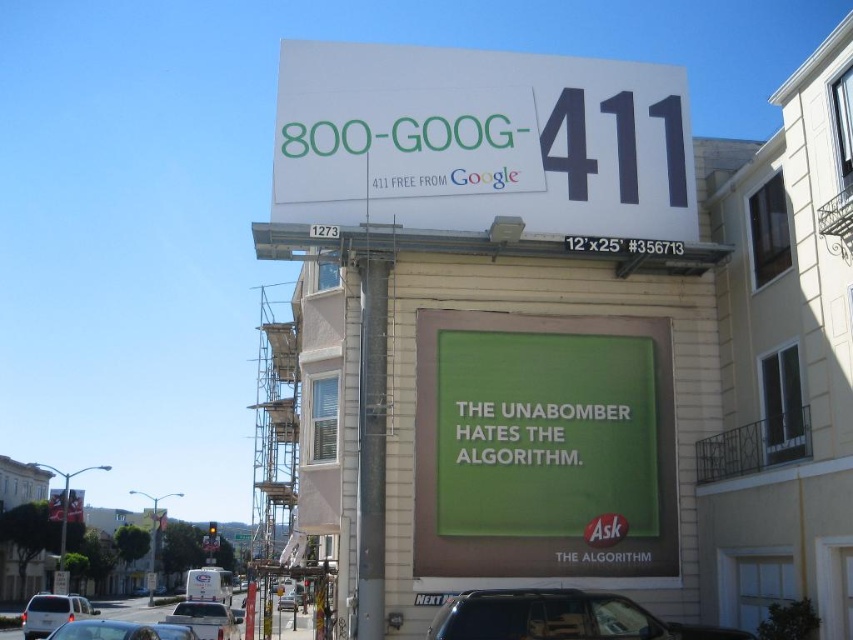
You are a photographer trying to capture the Google billboard in the scene. You notice two points marked on the billboard at coordinates point [108,624] and point [204,636]. Which point should you focus on first if you want to ensure both points are in sharp focus?

You should focus on point [108,624] first because it is closer to the camera than point [204,636]. This ensures that the closer point is in focus, and the farther point will also be within the depth of field if the focus is set correctly.

What is located at the coordinates point (480, 141) on the billboard?

The white paper billboard at upper center is located at point (480, 141).